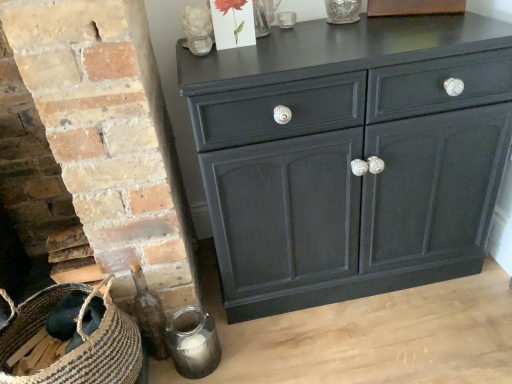
Question: Is matte paper card at upper center, which is the 2th flower in left-to-right order, positioned beyond the bounds of translucent glass flower at upper center, which is the 2th flower from right to left?

Choices:
 (A) no
 (B) yes

Answer: (B)

Question: From a real-world perspective, does matte paper card at upper center, the first flower from the right, stand above translucent glass flower at upper center, which is the first flower from left to right?

Choices:
 (A) no
 (B) yes

Answer: (B)

Question: Considering the relative sizes of matte paper card at upper center, which is the 2th flower in left-to-right order, and translucent glass flower at upper center, which is the 2th flower from right to left, in the image provided, is matte paper card at upper center, which is the 2th flower in left-to-right order, wider than translucent glass flower at upper center, which is the 2th flower from right to left,?

Choices:
 (A) yes
 (B) no

Answer: (B)

Question: Is matte paper card at upper center, which is the 2th flower in left-to-right order, with translucent glass flower at upper center, which is the 2th flower from right to left?

Choices:
 (A) yes
 (B) no

Answer: (A)

Question: Considering the relative sizes of matte paper card at upper center, which is the 2th flower in left-to-right order, and translucent glass flower at upper center, which is the 2th flower from right to left, in the image provided, is matte paper card at upper center, which is the 2th flower in left-to-right order, shorter than translucent glass flower at upper center, which is the 2th flower from right to left,?

Choices:
 (A) yes
 (B) no

Answer: (B)

Question: Is matte paper card at upper center, which is the 2th flower in left-to-right order, further to the viewer compared to translucent glass flower at upper center, which is the first flower from left to right?

Choices:
 (A) no
 (B) yes

Answer: (A)

Question: From a real-world perspective, is transparent glass vase at upper center on top of translucent glass flower at upper center, which is the first flower from left to right?

Choices:
 (A) no
 (B) yes

Answer: (B)

Question: From the image's perspective, is transparent glass vase at upper center under translucent glass flower at upper center, which is the first flower from left to right?

Choices:
 (A) no
 (B) yes

Answer: (A)

Question: Can you confirm if transparent glass vase at upper center is smaller than translucent glass flower at upper center, which is the 2th flower from right to left?

Choices:
 (A) yes
 (B) no

Answer: (B)

Question: Does transparent glass vase at upper center have a lesser width compared to translucent glass flower at upper center, which is the 2th flower from right to left?

Choices:
 (A) no
 (B) yes

Answer: (A)

Question: Is transparent glass vase at upper center aimed at translucent glass flower at upper center, which is the first flower from left to right?

Choices:
 (A) yes
 (B) no

Answer: (B)

Question: Is transparent glass vase at upper center closer to the viewer compared to translucent glass flower at upper center, which is the first flower from left to right?

Choices:
 (A) yes
 (B) no

Answer: (B)

Question: Is brown woven basket at lower left shorter than translucent glass flower at upper center, which is the 2th flower from right to left?

Choices:
 (A) no
 (B) yes

Answer: (A)